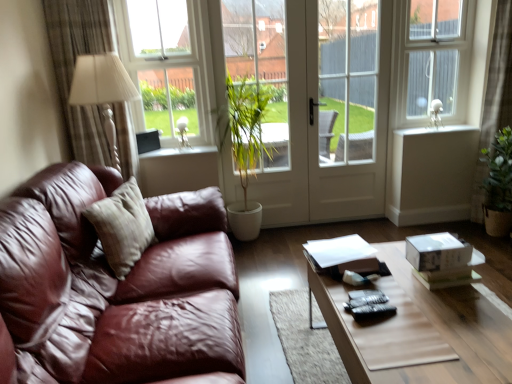
What do you see at coordinates (73, 70) in the screenshot? The height and width of the screenshot is (384, 512). I see `beige fabric curtain at left, which appears as the first curtain when viewed from the left` at bounding box center [73, 70].

Image resolution: width=512 pixels, height=384 pixels. Find the location of `white glossy screen door at center, marked as the second screen door in a right-to-left arrangement`. white glossy screen door at center, marked as the second screen door in a right-to-left arrangement is located at coordinates (319, 103).

Where is `white glossy window sill at upper center, the 1th window sill positioned from the bottom`? white glossy window sill at upper center, the 1th window sill positioned from the bottom is located at coordinates (179, 151).

From the picture: How much space does white glossy door at center, the first screen door in the right-to-left sequence, occupy horizontally?

white glossy door at center, the first screen door in the right-to-left sequence, is 4.14 inches in width.

Identify the location of white glossy door at center, the first screen door in the right-to-left sequence. Image resolution: width=512 pixels, height=384 pixels. (350, 111).

This screenshot has width=512, height=384. What do you see at coordinates (122, 227) in the screenshot? I see `beige fabric pillow at left` at bounding box center [122, 227].

Where is `beige fabric curtain at left, which is the 2th curtain from right to left`? The image size is (512, 384). beige fabric curtain at left, which is the 2th curtain from right to left is located at coordinates (73, 70).

Looking at this image, which is closer to the camera, (99, 203) or (486, 91)?

The point (99, 203) is in front.

Identify the location of the 2nd curtain behind the beige fabric pillow at left. The width and height of the screenshot is (512, 384). (498, 78).

Can you confirm if beige fabric pillow at left is wider than silky beige curtain at right, which is the second curtain in left-to-right order?

No.

Is wooden coffee table at center aimed at white glossy window sill at upper center, the 1th window sill positioned from the bottom?

No, wooden coffee table at center is not oriented towards white glossy window sill at upper center, the 1th window sill positioned from the bottom.

Measure the distance from wooden coffee table at center to white glossy window sill at upper center, marked as the first window sill in a left-to-right arrangement.

wooden coffee table at center is 1.96 meters from white glossy window sill at upper center, marked as the first window sill in a left-to-right arrangement.

Where is `coffee table below the white glossy window sill at upper center, the 1th window sill positioned from the bottom (from the image's perspective)`? coffee table below the white glossy window sill at upper center, the 1th window sill positioned from the bottom (from the image's perspective) is located at coordinates (419, 330).

Is white glossy window sill at upper center, marked as the first window sill in a left-to-right arrangement, inside wooden coffee table at center?

No, white glossy window sill at upper center, marked as the first window sill in a left-to-right arrangement, is not inside wooden coffee table at center.

In the scene shown: Which of these two, white glossy window sill at upper center, which appears as the second window sill when viewed from the right, or wooden coffee table at center, is bigger?

wooden coffee table at center is bigger.

How many degrees apart are the facing directions of white glossy window sill at upper center, marked as the first window sill in a left-to-right arrangement, and wooden coffee table at center?

They differ by 90.3 degrees in their facing directions.

Is white glossy window sill at upper center, which appears as the second window sill when viewed from the right, oriented away from wooden coffee table at center?

No, white glossy window sill at upper center, which appears as the second window sill when viewed from the right, is not facing the opposite direction of wooden coffee table at center.

From their relative heights in the image, would you say white glossy window sill at upper center, marked as the first window sill in a left-to-right arrangement, is taller or shorter than wooden coffee table at center?

Clearly, white glossy window sill at upper center, marked as the first window sill in a left-to-right arrangement, is shorter compared to wooden coffee table at center.

Considering the relative positions of white glossy screen door at center, which is the first screen door from left to right, and silky beige curtain at right, which is the second curtain in left-to-right order, in the image provided, is white glossy screen door at center, which is the first screen door from left to right, in front of silky beige curtain at right, which is the second curtain in left-to-right order,?

No, white glossy screen door at center, which is the first screen door from left to right, is behind silky beige curtain at right, which is the second curtain in left-to-right order.

Can we say white glossy screen door at center, marked as the second screen door in a right-to-left arrangement, lies outside silky beige curtain at right, which is the second curtain in left-to-right order?

That's correct, white glossy screen door at center, marked as the second screen door in a right-to-left arrangement, is outside of silky beige curtain at right, which is the second curtain in left-to-right order.

Which is closer to the camera, (248, 194) or (493, 79)?

Point (248, 194) is farther from the camera than point (493, 79).

Is wooden coffee table at center next to beige fabric curtain at left, which is the 2th curtain from right to left?

No, wooden coffee table at center is not next to beige fabric curtain at left, which is the 2th curtain from right to left.

In the image, is wooden coffee table at center positioned in front of or behind beige fabric curtain at left, which appears as the first curtain when viewed from the left?

Clearly, wooden coffee table at center is in front of beige fabric curtain at left, which appears as the first curtain when viewed from the left.

How much distance is there between wooden coffee table at center and beige fabric curtain at left, which is the 2th curtain from right to left?

wooden coffee table at center and beige fabric curtain at left, which is the 2th curtain from right to left, are 6.76 feet apart from each other.

Would you say beige fabric curtain at left, which appears as the first curtain when viewed from the left, is part of wooden coffee table at center's contents?

Actually, beige fabric curtain at left, which appears as the first curtain when viewed from the left, is outside wooden coffee table at center.

Between point (459, 32) and point (340, 346), which one is positioned behind?

The point (459, 32) is more distant.

Based on the photo, is wooden coffee table at center inside white plastic window frame at upper right?

Definitely not — wooden coffee table at center is not inside white plastic window frame at upper right.

Could you tell me if white plastic window frame at upper right is facing wooden coffee table at center?

No.

At what (x,y) coordinates should I click in order to perform the action: click on coffee table that is under the beige fabric curtain at left, which appears as the first curtain when viewed from the left (from a real-world perspective). Please return your answer as a coordinate pair (x, y). Image resolution: width=512 pixels, height=384 pixels. Looking at the image, I should click on (419, 330).

Is point (124, 111) positioned behind point (400, 328)?

That is True.

Is beige fabric curtain at left, which appears as the first curtain when viewed from the left, spatially inside wooden coffee table at center, or outside of it?

beige fabric curtain at left, which appears as the first curtain when viewed from the left, is outside wooden coffee table at center.

Is beige fabric curtain at left, which is the 2th curtain from right to left, to the right of wooden coffee table at center from the viewer's perspective?

No, beige fabric curtain at left, which is the 2th curtain from right to left, is not to the right of wooden coffee table at center.

From the beige fabric pillow at left, count 2nd curtains backward and point to it. Please provide its 2D coordinates.

[(498, 78)]

Identify the location of coffee table directly beneath the white glossy window sill at upper center, the 1th window sill positioned from the bottom (from a real-world perspective). (419, 330).

Estimate the real-world distances between objects in this image. Which object is further from wooden coffee table at center, clear glass window at upper left or white glossy window sill at upper center, acting as the 2th window sill starting from the top?

clear glass window at upper left.

Which object lies further to the anchor point wooden coffee table at center, white glossy screen door at center, which is the first screen door from left to right, or silky beige curtain at right, marked as the 1th curtain in a right-to-left arrangement?

The object further to wooden coffee table at center is silky beige curtain at right, marked as the 1th curtain in a right-to-left arrangement.

Considering their positions, is clear glass window at upper left positioned closer to white glossy screen door at center, marked as the second screen door in a right-to-left arrangement, than beige fabric curtain at left, which appears as the first curtain when viewed from the left?

clear glass window at upper left is closer to white glossy screen door at center, marked as the second screen door in a right-to-left arrangement.

Which object lies nearer to the anchor point clear glass window at upper left, white glossy window sill at upper center, the 1th window sill positioned from the bottom, or white glossy door at center, the first screen door in the right-to-left sequence?

Based on the image, white glossy window sill at upper center, the 1th window sill positioned from the bottom, appears to be nearer to clear glass window at upper left.

Looking at the image, which one is located closer to beige fabric pillow at left, wooden coffee table at center or beige fabric curtain at left, which is the 2th curtain from right to left?

Based on the image, beige fabric curtain at left, which is the 2th curtain from right to left, appears to be nearer to beige fabric pillow at left.

Based on their spatial positions, is white glossy screen door at center, marked as the second screen door in a right-to-left arrangement, or white glossy door at center, the first screen door in the right-to-left sequence, closer to white glossy window sill at upper center, acting as the 2th window sill starting from the top?

white glossy screen door at center, marked as the second screen door in a right-to-left arrangement, is closer to white glossy window sill at upper center, acting as the 2th window sill starting from the top.

From the image, which object appears to be nearer to white smooth window sill at upper right, the 1th window sill viewed from the right, white glossy window sill at upper center, which appears as the second window sill when viewed from the right, or green leafy plant at center?

green leafy plant at center is closer to white smooth window sill at upper right, the 1th window sill viewed from the right.

When comparing their distances from wooden coffee table at center, does white plastic window frame at upper right or silky beige curtain at right, which is the second curtain in left-to-right order, seem further?

Among the two, silky beige curtain at right, which is the second curtain in left-to-right order, is located further to wooden coffee table at center.

Find the location of a particular element. This screenshot has width=512, height=384. window sill between beige fabric curtain at left, which appears as the first curtain when viewed from the left, and green leafy plant at center from left to right is located at coordinates (179, 151).

Identify the location of window between beige fabric curtain at left, which appears as the first curtain when viewed from the left, and silky beige curtain at right, which is the second curtain in left-to-right order, in the horizontal direction. Image resolution: width=512 pixels, height=384 pixels. (168, 66).

Identify the location of window frame situated between white glossy screen door at center, which is the first screen door from left to right, and silky beige curtain at right, marked as the 1th curtain in a right-to-left arrangement, from left to right. (434, 59).

Locate an element on the screen. window frame situated between beige fabric curtain at left, which appears as the first curtain when viewed from the left, and white smooth window sill at upper right, which ranks as the 1th window sill in top-to-bottom order, from left to right is located at coordinates (434, 59).